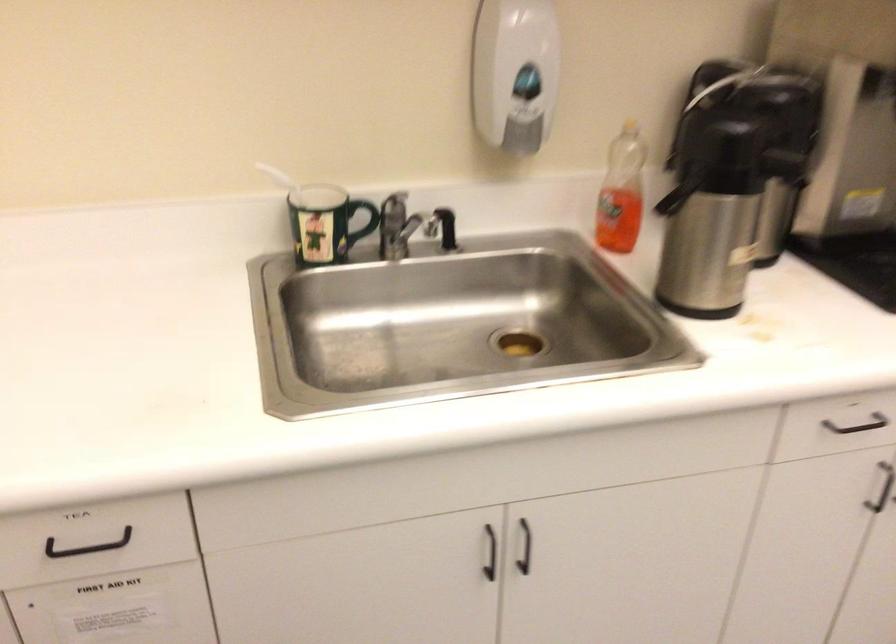
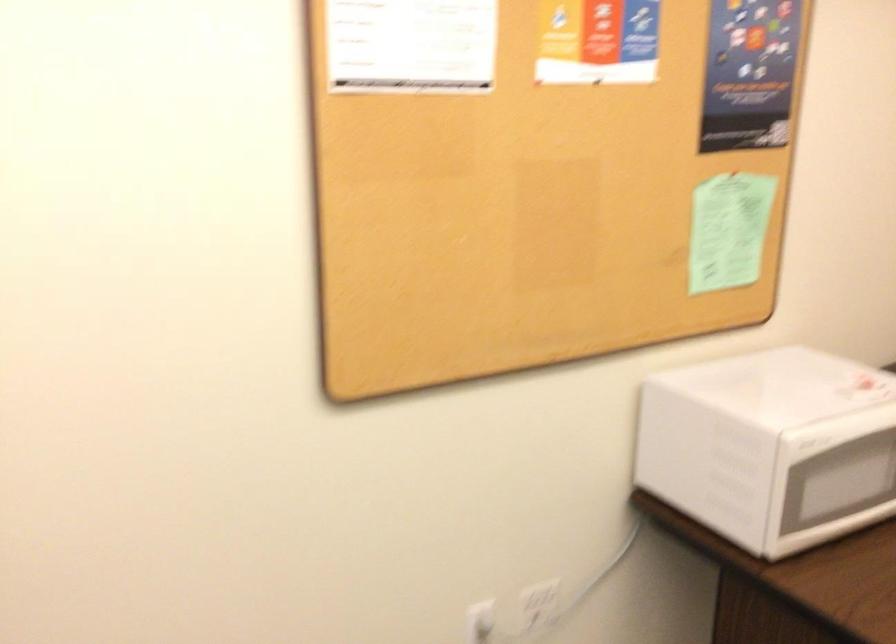
The images are taken continuously from a first-person perspective. In which direction is your viewpoint rotating?

The rotation direction of the camera is right-down.